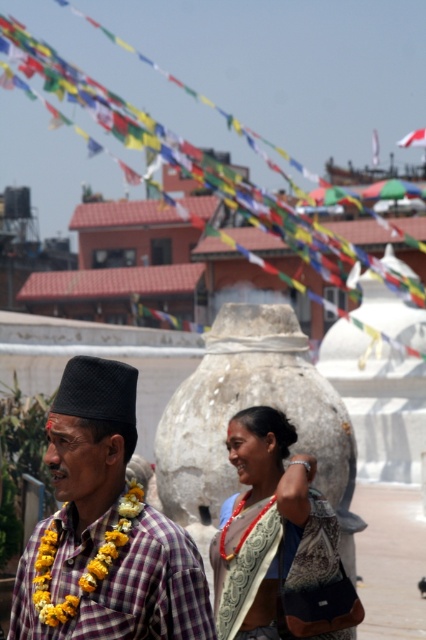
Please write a question based on the provided information without revealing the specific details in the Objects Description. The question should ask about the position of the plaid fabric shirt at center in the image. The answer should use the coordinates from the Objects Description to provide an exact location. Remember to include the object label exactly as given in the Objects section in both the question and the answer.

The plaid fabric shirt at center is located at the 2D coordinates point [104,529] in the image.

You are a tailor who needs to determine which item, the plaid fabric shirt at center or the matte gold necklace at center, requires more space for storage. Based on the image, which one is wider?

The plaid fabric shirt at center is wider than the matte gold necklace at center, so it requires more space for storage.